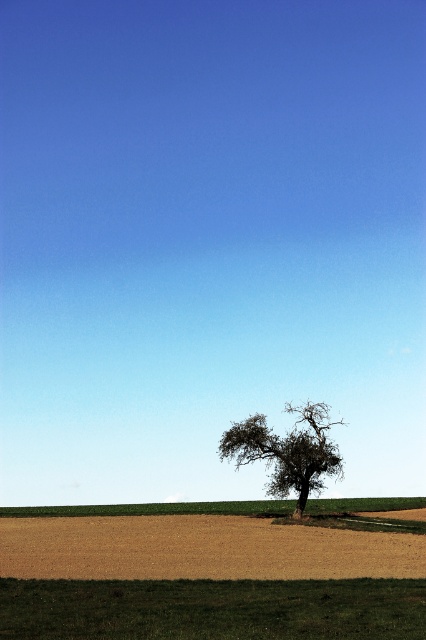
Who is positioned more to the left, brown matte wheat field at lower center or dark green textured tree at center?

From the viewer's perspective, dark green textured tree at center appears more on the left side.

Is point (138, 552) positioned before point (278, 436)?

Yes.

This screenshot has width=426, height=640. What are the coordinates of `brown matte wheat field at lower center` in the screenshot? It's located at (199, 548).

At what (x,y) coordinates should I click in order to perform the action: click on brown matte wheat field at lower center. Please return your answer as a coordinate pair (x, y). The width and height of the screenshot is (426, 640). Looking at the image, I should click on (199, 548).